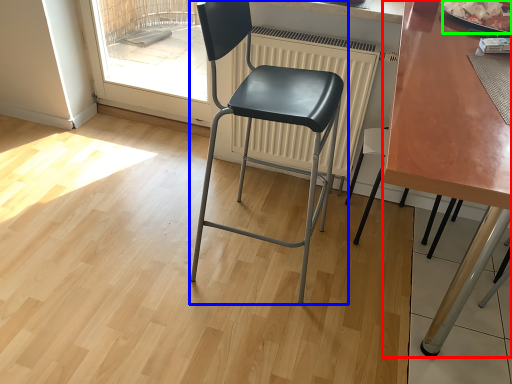
Question: Considering the real-world distances, which object is farthest from table (highlighted by a red box)? chair (highlighted by a blue box) or food (highlighted by a green box)?

Choices:
 (A) chair
 (B) food

Answer: (A)